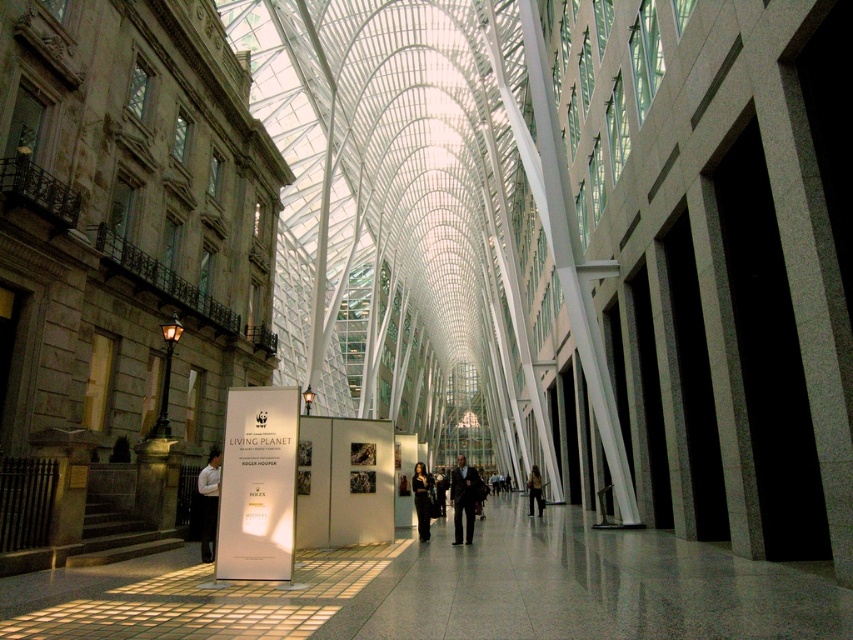
Question: Is dark suit at center above dark brown leather jacket at center?

Choices:
 (A) no
 (B) yes

Answer: (B)

Question: Observing the image, what is the correct spatial positioning of white shirt at center in reference to black fabric dress at center?

Choices:
 (A) below
 (B) above

Answer: (A)

Question: Can you confirm if white shirt at center is positioned to the right of dark brown leather jacket at center?

Choices:
 (A) no
 (B) yes

Answer: (A)

Question: Estimate the real-world distances between objects in this image. Which object is closer to the dark suit at center?

Choices:
 (A) white shirt at center
 (B) dark brown leather jacket at center
 (C) black fabric dress at center

Answer: (C)

Question: Which object appears farthest from the camera in this image?

Choices:
 (A) black fabric dress at center
 (B) dark brown leather jacket at center

Answer: (B)

Question: Which object is farther from the camera taking this photo?

Choices:
 (A) white shirt at center
 (B) black fabric dress at center

Answer: (B)